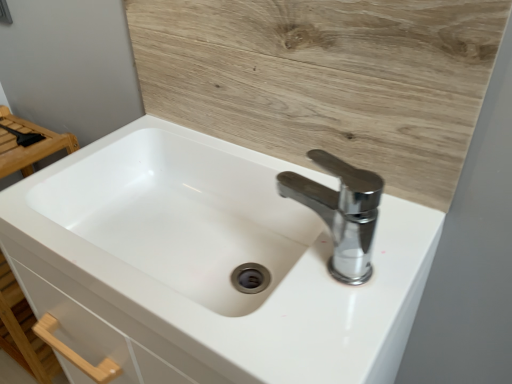
Question: From a real-world perspective, is white glossy sink at center positioned above or below wooden at upper center?

Choices:
 (A) above
 (B) below

Answer: (B)

Question: Is white glossy sink at center bigger or smaller than wooden at upper center?

Choices:
 (A) small
 (B) big

Answer: (B)

Question: Estimate the real-world distances between objects in this image. Which object is farther from the white glossy sink at center?

Choices:
 (A) wooden at upper center
 (B) chrome metallic faucet at upper right

Answer: (A)

Question: Estimate the real-world distances between objects in this image. Which object is farther from the white glossy sink at center?

Choices:
 (A) wooden at upper center
 (B) chrome metallic faucet at upper right

Answer: (A)